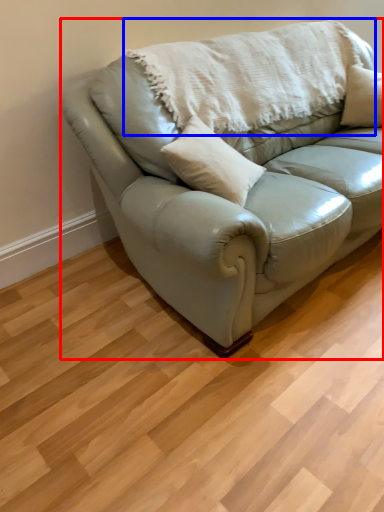
Question: Which of the following is the farthest to the observer, studio couch (highlighted by a red box) or blanket (highlighted by a blue box)?

Choices:
 (A) studio couch
 (B) blanket

Answer: (B)